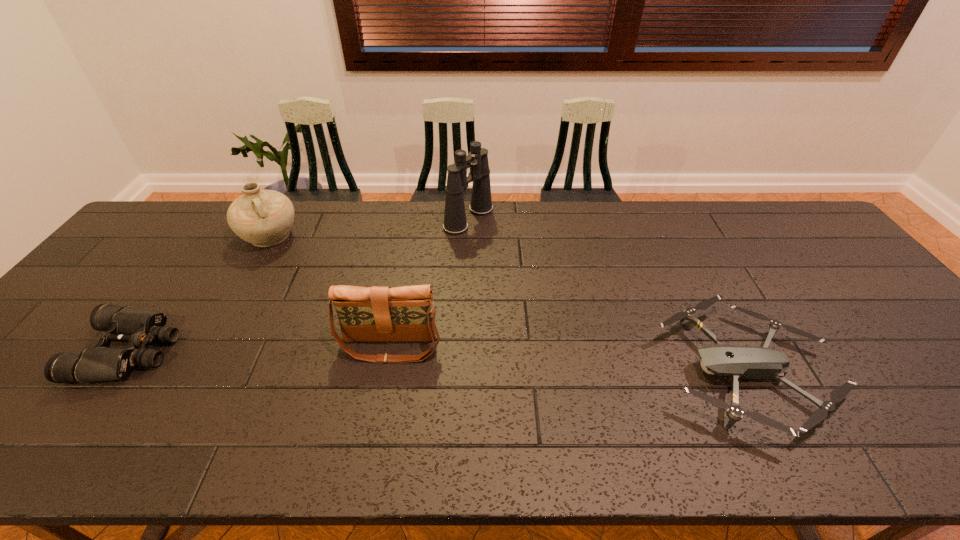
The image size is (960, 540). In order to click on vacant area located on the front-facing side of the shoulder bag in this screenshot , I will do click(x=378, y=409).

Find the location of `free spot located through the eyepieces of the shorter binoculars`. free spot located through the eyepieces of the shorter binoculars is located at coordinates (226, 350).

Identify the location of free space located with a camera mounted on the front of the drone. This screenshot has width=960, height=540. (500, 370).

Locate an element on the screen. free point located 0.290m with a camera mounted on the front of the drone is located at coordinates (539, 370).

Where is `vacant region located 0.290m with a camera mounted on the front of the drone`? This screenshot has width=960, height=540. vacant region located 0.290m with a camera mounted on the front of the drone is located at coordinates (539, 370).

What are the coordinates of `binoculars that is at the far edge` in the screenshot? It's located at (455, 223).

Identify the location of pottery at the far edge. This screenshot has height=540, width=960. (264, 218).

The image size is (960, 540). In order to click on object located in the near edge section of the desktop in this screenshot , I will do `click(740, 362)`.

Where is `object located in the left edge section of the desktop`? object located in the left edge section of the desktop is located at coordinates (138, 327).

In order to click on vacant space at the far edge in this screenshot , I will do `click(208, 231)`.